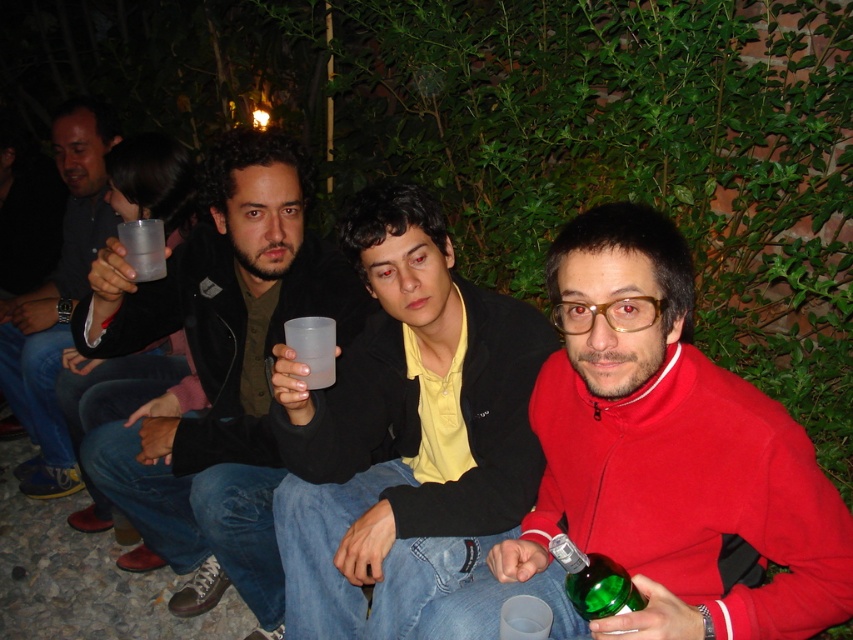
Who is higher up, matte black jacket at upper left or green glass bottle at lower right?

matte black jacket at upper left is above.

Can you confirm if matte black jacket at upper left is positioned below green glass bottle at lower right?

No.

Image resolution: width=853 pixels, height=640 pixels. In order to click on matte black jacket at upper left in this screenshot , I will do `click(57, 298)`.

Is transparent plastic cup at center wider than transparent plastic cup at upper left?

Result: In fact, transparent plastic cup at center might be narrower than transparent plastic cup at upper left.

Find the location of a particular element. transparent plastic cup at center is located at coordinates (312, 348).

Consider the image. Who is shorter, matte red sweater at center or green glass bottle at lower right?

Standing shorter between the two is green glass bottle at lower right.

Does point (695, 362) come behind point (589, 563)?

Yes, it is.

Where is `matte red sweater at center`? matte red sweater at center is located at coordinates (670, 451).